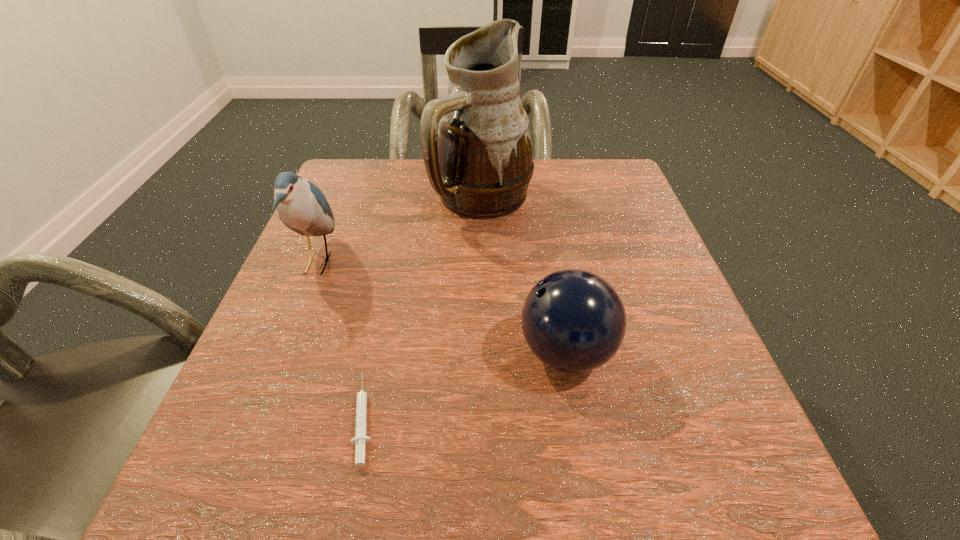
Identify the location of the farthest object. (476, 146).

In order to click on pitcher in this screenshot , I will do `click(476, 146)`.

The height and width of the screenshot is (540, 960). What are the coordinates of `bird` in the screenshot? It's located at click(x=302, y=207).

This screenshot has width=960, height=540. In order to click on the second tallest object in this screenshot , I will do `click(302, 207)`.

At what (x,y) coordinates should I click in order to perform the action: click on bowling ball. Please return your answer as a coordinate pair (x, y). This screenshot has width=960, height=540. Looking at the image, I should click on (574, 321).

Where is `the third object from right to left`? Image resolution: width=960 pixels, height=540 pixels. the third object from right to left is located at coordinates (360, 439).

At what (x,y) coordinates should I click in order to perform the action: click on the shortest object. Please return your answer as a coordinate pair (x, y). This screenshot has height=540, width=960. Looking at the image, I should click on (360, 439).

At what (x,y) coordinates should I click in order to perform the action: click on free space located from the spout of the tallest object. Please return your answer as a coordinate pair (x, y). This screenshot has height=540, width=960. Looking at the image, I should click on (484, 382).

Where is `vacant point located at the tip of the third nearest object's beak`? vacant point located at the tip of the third nearest object's beak is located at coordinates (373, 263).

Find the location of `free space located on the surface of the second shortest object near the finger holes`. free space located on the surface of the second shortest object near the finger holes is located at coordinates (468, 352).